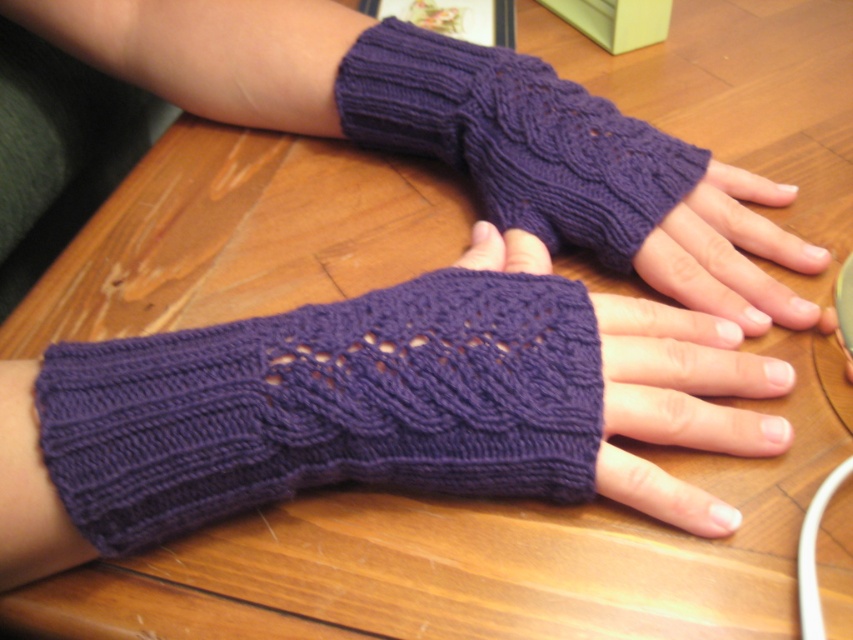
You are organizing a craft fair and need to arrange these items on a display table. You have two purple knitted fingerless gloves at center and a matte purple fingerless gloves at center. According to the image, which glove should be placed on the left side of the display?

The purple knitted fingerless gloves at center should be placed on the left side of the display because in the image, the purple knitted fingerless gloves at center is to the left of the matte purple fingerless gloves at center.

You are organizing a craft fair and need to arrange these two items. The purple knitted fingerless glove at center and the matte purple fingerless gloves at center are both displayed on a wooden table. Which one is located to the left?

The purple knitted fingerless glove at center is positioned on the left side of matte purple fingerless gloves at center, so it is the one located to the left.

You are a tailor examining the purple knitted fingerless glove at center and the purple knitted fingerless gloves at center displayed on a wooden table. Which one is shorter in height?

The purple knitted fingerless glove at center is shorter in height compared to the purple knitted fingerless gloves at center.